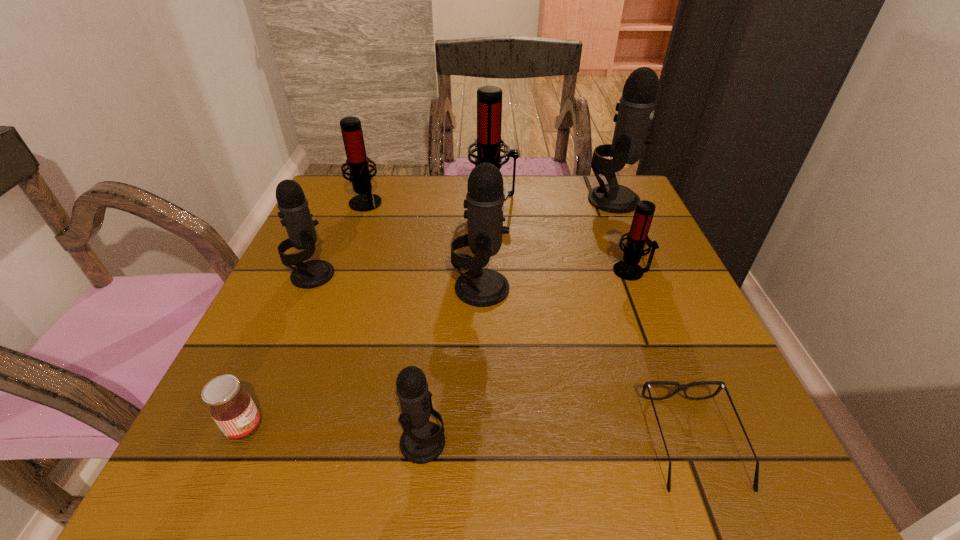
The height and width of the screenshot is (540, 960). I want to click on the biggest black microphone, so click(636, 108).

You are a GUI agent. You are given a task and a screenshot of the screen. Output one action in this format:
    pyautogui.click(x=<x>, y=<y>)
    Task: Click on the rightmost black microphone
    Image resolution: width=960 pixels, height=540 pixels.
    Given the screenshot: What is the action you would take?
    pyautogui.click(x=636, y=108)

Locate an element on the screen. This screenshot has width=960, height=540. the biggest red microphone is located at coordinates (489, 98).

Locate an element on the screen. The width and height of the screenshot is (960, 540). the second biggest black microphone is located at coordinates (484, 201).

Find the location of a particular element. This screenshot has width=960, height=540. the second smallest red microphone is located at coordinates (357, 161).

Locate an element on the screen. the leftmost black microphone is located at coordinates (294, 210).

Where is `the smallest red microphone`? the smallest red microphone is located at coordinates (628, 269).

Locate an element on the screen. Image resolution: width=960 pixels, height=540 pixels. the rightmost red microphone is located at coordinates (628, 269).

Find the location of a particular element. the smallest black microphone is located at coordinates (422, 441).

The image size is (960, 540). Find the location of `the nearest black microphone`. the nearest black microphone is located at coordinates (422, 441).